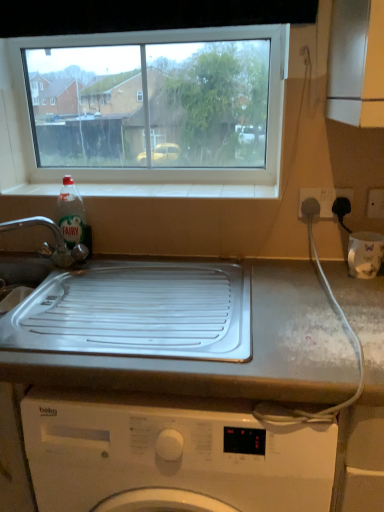
Question: Is transparent glass window at upper center further to camera compared to white plastic electric outlet at right, positioned as the 2th electric outlet in left-to-right order?

Choices:
 (A) no
 (B) yes

Answer: (B)

Question: Considering the relative sizes of transparent glass window at upper center and white plastic electric outlet at right, which is counted as the first electric outlet, starting from the right, in the image provided, is transparent glass window at upper center bigger than white plastic electric outlet at right, which is counted as the first electric outlet, starting from the right,?

Choices:
 (A) yes
 (B) no

Answer: (A)

Question: Would you consider transparent glass window at upper center to be distant from white plastic electric outlet at right, which is counted as the first electric outlet, starting from the right?

Choices:
 (A) yes
 (B) no

Answer: (A)

Question: Is transparent glass window at upper center thinner than white plastic electric outlet at right, which is counted as the first electric outlet, starting from the right?

Choices:
 (A) no
 (B) yes

Answer: (A)

Question: Could you tell me if transparent glass window at upper center is turned towards white plastic electric outlet at right, positioned as the 2th electric outlet in left-to-right order?

Choices:
 (A) no
 (B) yes

Answer: (A)

Question: Is transparent glass window at upper center wider than white plastic electric outlet at right, positioned as the 2th electric outlet in left-to-right order?

Choices:
 (A) no
 (B) yes

Answer: (B)

Question: Is brushed metal tap at left completely or partially inside white tile at upper center?

Choices:
 (A) no
 (B) yes

Answer: (A)

Question: Is white tile at upper center turned away from brushed metal tap at left?

Choices:
 (A) no
 (B) yes

Answer: (A)

Question: From the image's perspective, is white tile at upper center above brushed metal tap at left?

Choices:
 (A) yes
 (B) no

Answer: (A)

Question: Is white tile at upper center oriented towards brushed metal tap at left?

Choices:
 (A) yes
 (B) no

Answer: (B)

Question: Is white tile at upper center to the left of brushed metal tap at left from the viewer's perspective?

Choices:
 (A) no
 (B) yes

Answer: (A)

Question: Is white tile at upper center behind brushed metal tap at left?

Choices:
 (A) no
 (B) yes

Answer: (B)

Question: Is clear plastic bottle at sink left outside white plastic socket at upper right, which is counted as the first electric outlet, starting from the left?

Choices:
 (A) no
 (B) yes

Answer: (B)